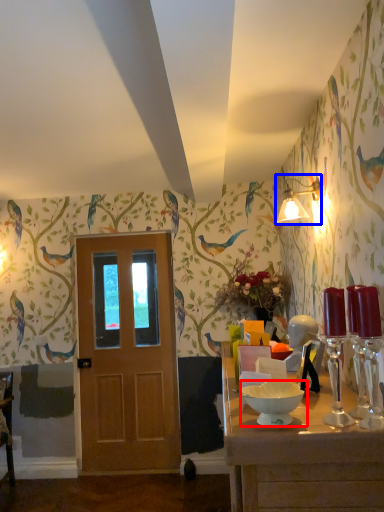
Question: Which object appears farthest to the camera in this image, bowl (highlighted by a red box) or light fixture (highlighted by a blue box)?

Choices:
 (A) bowl
 (B) light fixture

Answer: (B)